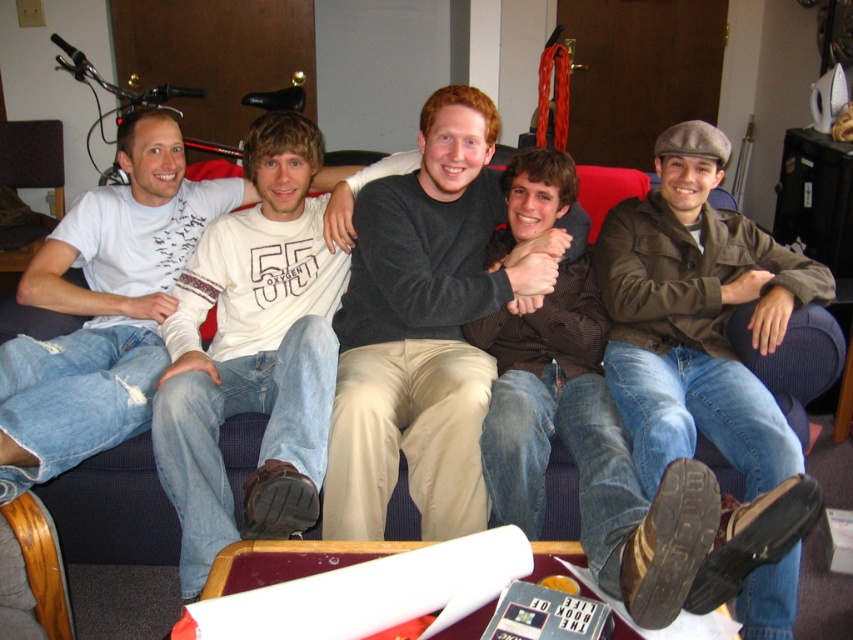
You are a photographer trying to capture a candid shot of the group. You want to ensure that both the dark gray sweater at center and the brown leather jacket at right are clearly visible in the frame. Based on their positions, which object is closer to the left side of the photo?

The dark gray sweater at center is positioned to the left of the brown leather jacket at right, so it will appear closer to the left side of the photo.

You are a photographer trying to capture a group photo of the individuals on the couch. You notice the white cotton shirt at center and the brown textured shirt at center. Which shirt should you adjust to ensure both shirts are visible in the frame without overlapping?

The white cotton shirt at center is wider than the brown textured shirt at center, so you should adjust the white cotton shirt at center to prevent overlap and ensure both are visible.

You are trying to decide whether to place a new rectangular cushion between the brown leather jacket at right and the brown textured shirt at center. Based on their widths, which object should the cushion be placed closer to?

The cushion should be placed closer to the brown textured shirt at center because the brown leather jacket at right might be wider, requiring more space between them.